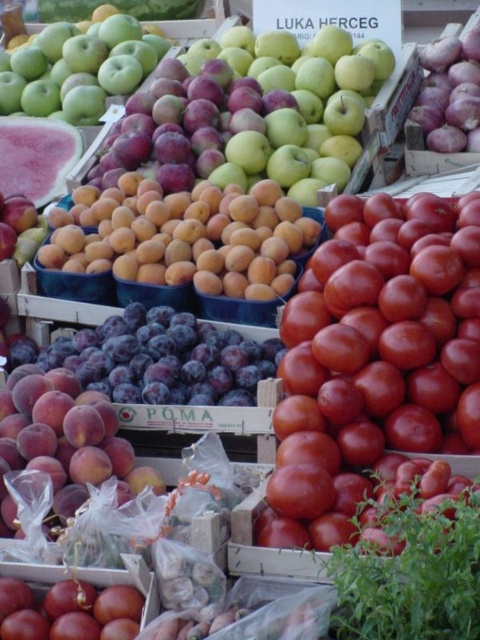
You are a customer at the market stall and want to find the glossy red tomato at center. According to the coordinates provided, where would you look relative to the other items?

The glossy red tomato at center is located at coordinates point (x=375, y=368), which places it centrally in the image. Since other items like plums and peaches are positioned to the left and below respectively, the glossy red tomato at center is positioned towards the upper right relative to the plums and above the peaches.

You are a customer at the market stall and want to pick both the glossy red tomato at center and the shiny peach at center. How far apart are these two items from each other?

The glossy red tomato at center is 4.29 feet away from the shiny peach at center.